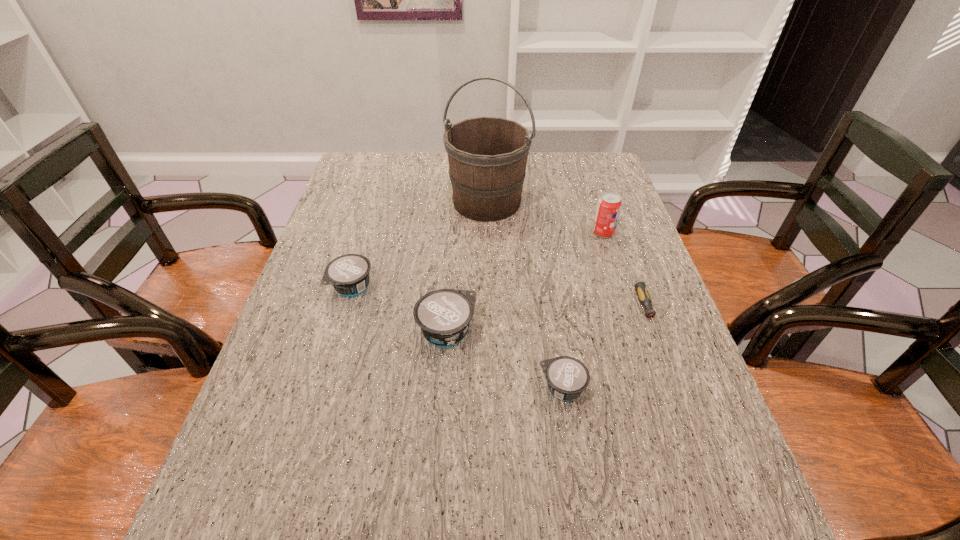
The width and height of the screenshot is (960, 540). In order to click on the leftmost yogurt in this screenshot , I will do `click(349, 274)`.

I want to click on the leftmost object, so click(349, 274).

What are the coordinates of `the second yogurt from right to left` in the screenshot? It's located at (443, 315).

You are a GUI agent. You are given a task and a screenshot of the screen. Output one action in this format:
    pyautogui.click(x=<x>, y=<y>)
    Task: Click on the tallest yogurt
    This screenshot has width=960, height=540.
    Given the screenshot: What is the action you would take?
    pyautogui.click(x=443, y=315)

Image resolution: width=960 pixels, height=540 pixels. Identify the location of the rightmost yogurt. (567, 377).

Locate an element on the screen. The width and height of the screenshot is (960, 540). the shortest yogurt is located at coordinates (567, 377).

What are the coordinates of `bucket` in the screenshot? It's located at (487, 156).

You are a GUI agent. You are given a task and a screenshot of the screen. Output one action in this format:
    pyautogui.click(x=<x>, y=<y>)
    Task: Click on the fifth shortest object
    This screenshot has width=960, height=540.
    Given the screenshot: What is the action you would take?
    pyautogui.click(x=609, y=205)

The image size is (960, 540). I want to click on the shortest object, so click(641, 289).

Image resolution: width=960 pixels, height=540 pixels. In order to click on free space located on the front of the leftmost object in this screenshot , I will do `click(321, 399)`.